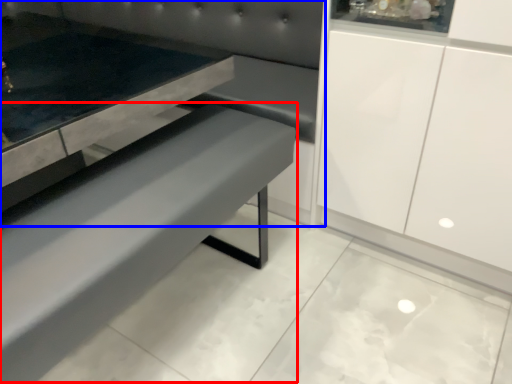
Question: Which point is further to the camera, park bench (highlighted by a red box) or couch (highlighted by a blue box)?

Choices:
 (A) park bench
 (B) couch

Answer: (B)